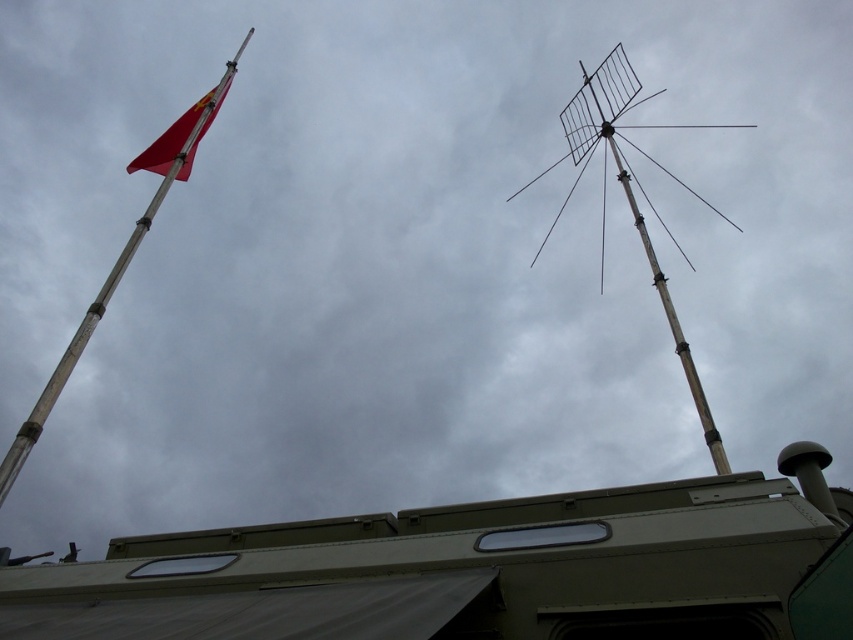
Is metallic antenna at upper right taller than red matte flag at upper left?

Yes, metallic antenna at upper right is taller than red matte flag at upper left.

Who is more distant from viewer, (625, 193) or (148, 164)?

The point (625, 193) is behind.

Does point (722, 454) come behind point (186, 177)?

No, (722, 454) is in front of (186, 177).

I want to click on metallic antenna at upper right, so click(x=630, y=195).

Consider the image. Who is shorter, matte green recreational vehicle at lower center or metallic antenna at upper right?

Standing shorter between the two is matte green recreational vehicle at lower center.

Which of these two, matte green recreational vehicle at lower center or metallic antenna at upper right, stands taller?

metallic antenna at upper right

Image resolution: width=853 pixels, height=640 pixels. Describe the element at coordinates (479, 570) in the screenshot. I see `matte green recreational vehicle at lower center` at that location.

Find the location of a particular element. matte green recreational vehicle at lower center is located at coordinates (479, 570).

Does matte green recreational vehicle at lower center lie in front of metallic flag pole at left?

Yes, it is in front of metallic flag pole at left.

What do you see at coordinates (479, 570) in the screenshot? I see `matte green recreational vehicle at lower center` at bounding box center [479, 570].

Between point (572, 625) and point (10, 445), which one is positioned in front?

Point (572, 625) is in front.

Where is `matte green recreational vehicle at lower center`? matte green recreational vehicle at lower center is located at coordinates (479, 570).